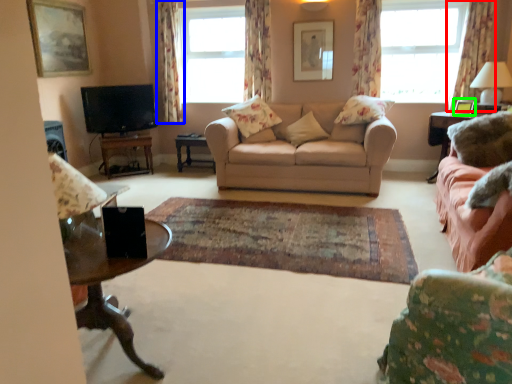
Question: Which object is positioned closest to curtain (highlighted by a red box)? Select from curtain (highlighted by a blue box) and picture frame (highlighted by a green box).

Choices:
 (A) curtain
 (B) picture frame

Answer: (B)